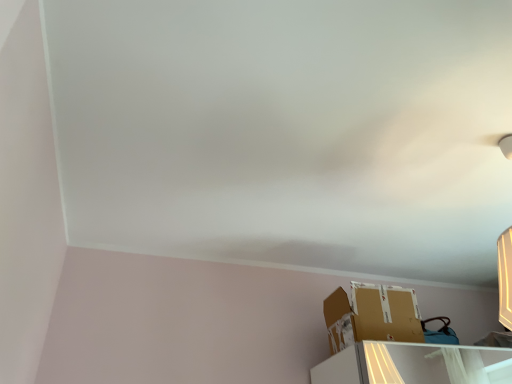
The width and height of the screenshot is (512, 384). In order to click on brown cardboard box at lower right in this screenshot , I will do `click(372, 315)`.

The width and height of the screenshot is (512, 384). Describe the element at coordinates (372, 315) in the screenshot. I see `brown cardboard box at lower right` at that location.

Identify the location of brown cardboard box at lower right. This screenshot has width=512, height=384. (372, 315).